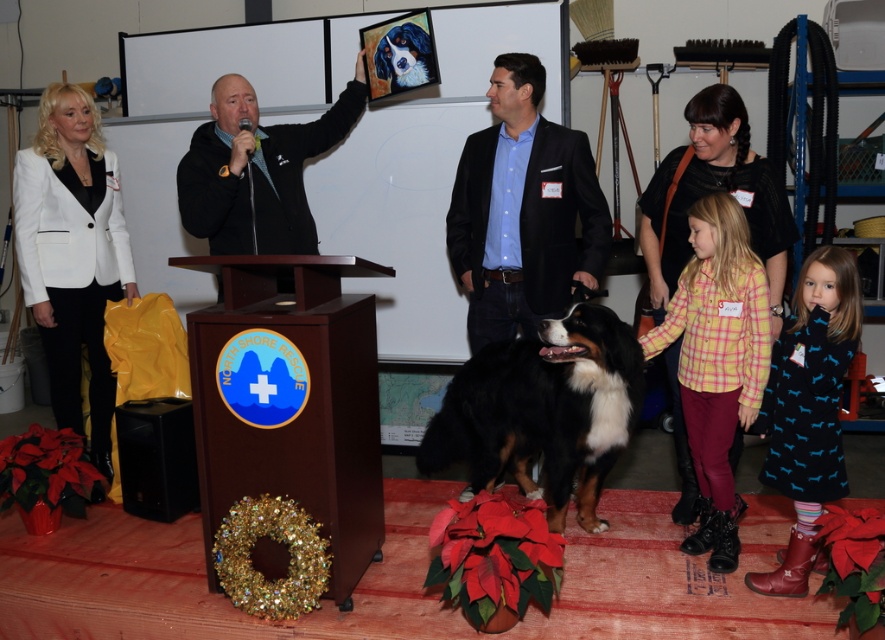
You are attending a presentation at the North Shore Rescue event and notice the mahogany wood podium at center and the white matte blazer at left. Which object is positioned closer to you?

The mahogany wood podium at center is closer to the viewer than the white matte blazer at left.

You are attending a formal event and notice two attendees wearing a white matte blazer at left and a yellow plaid shirt at center. Which one is closer to the front of the stage?

The white matte blazer at left is closer to the front of the stage because the yellow plaid shirt at center is behind it.